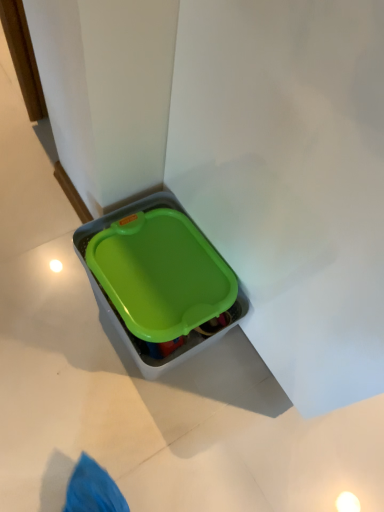
You are a GUI agent. You are given a task and a screenshot of the screen. Output one action in this format:
    pyautogui.click(x=<x>, y=<y>)
    Task: Click on the vacant space situated above green plastic container at lower left (from a real-world perspective)
    This screenshot has width=384, height=512.
    Given the screenshot: What is the action you would take?
    pyautogui.click(x=141, y=236)